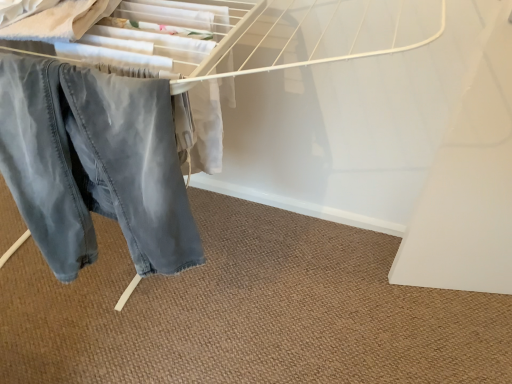
In order to face denim pants at left, should I rotate leftwards or rightwards?

Turn left by 21.267 degrees to look at denim pants at left.

Describe the element at coordinates (94, 164) in the screenshot. I see `denim pants at left` at that location.

This screenshot has width=512, height=384. I want to click on denim pants at left, so (94, 164).

The width and height of the screenshot is (512, 384). Identify the location of denim pants at left. (94, 164).